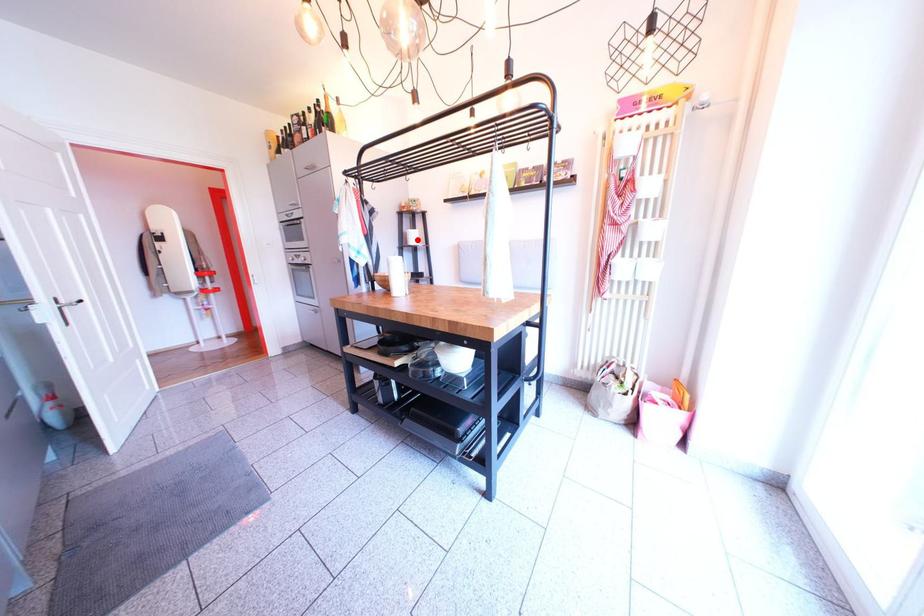
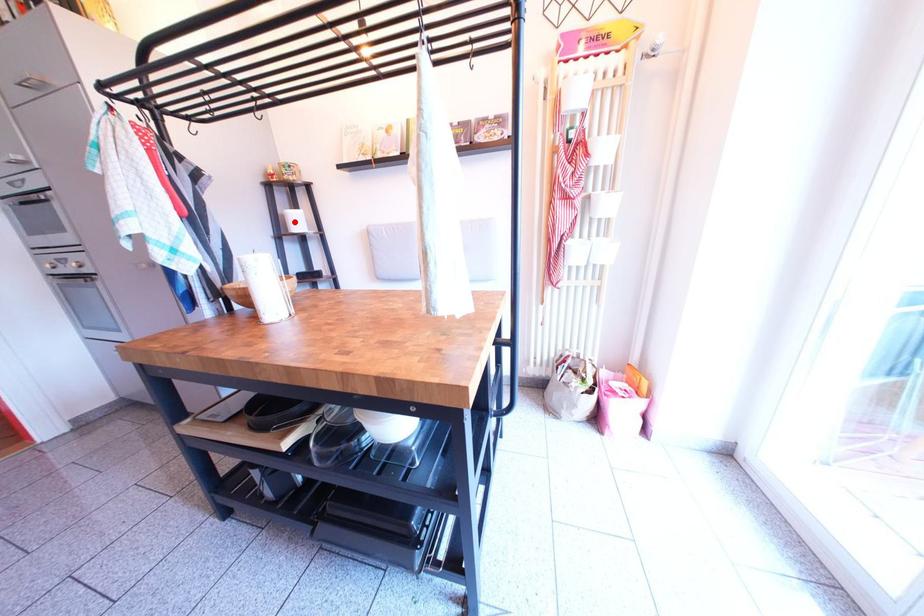
I am providing you with two images of the same scene from different viewpoints. A red point is marked on the first image and another point is marked on the second image. Do the highlighted points in image1 and image2 indicate the same real-world spot?

Yes